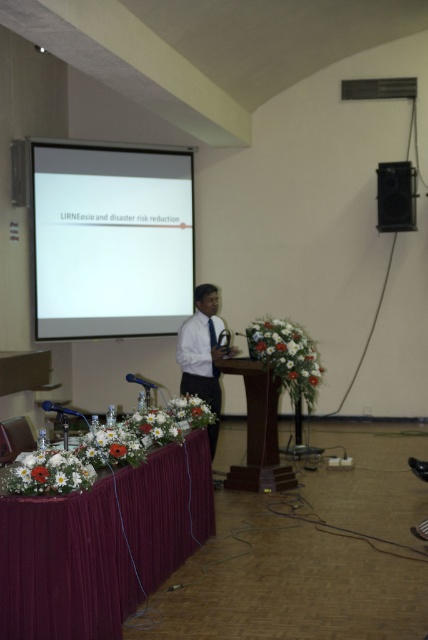
Question: Among these objects, which one is nearest to the camera?

Choices:
 (A) white shirt at center
 (B) velvet burgundy tablecloth at lower left
 (C) wooden at center
 (D) white matte projection screen at upper left

Answer: (B)

Question: Is white matte projection screen at upper left to the right of black matte speaker at upper right from the viewer's perspective?

Choices:
 (A) yes
 (B) no

Answer: (B)

Question: Where is velvet burgundy tablecloth at lower left located in relation to wooden at center in the image?

Choices:
 (A) above
 (B) below

Answer: (B)

Question: Does white matte projection screen at upper left appear under black matte speaker at upper right?

Choices:
 (A) yes
 (B) no

Answer: (A)

Question: Which object appears farthest from the camera in this image?

Choices:
 (A) white matte projection screen at upper left
 (B) black matte speaker at upper right

Answer: (B)

Question: Which object is closer to the camera taking this photo?

Choices:
 (A) black matte speaker at upper right
 (B) white shirt at center
 (C) white matte projection screen at upper left

Answer: (B)